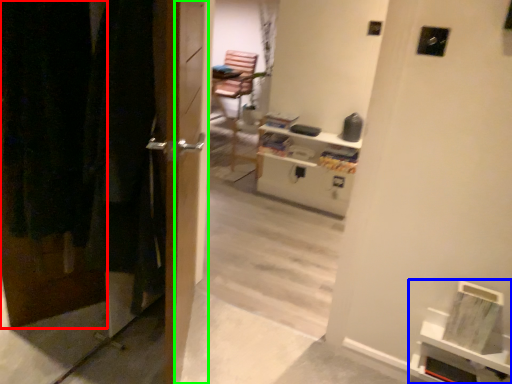
Question: Which object is the farthest from door (highlighted by a red box)? Choose among these: shelf (highlighted by a blue box) or screen door (highlighted by a green box).

Choices:
 (A) shelf
 (B) screen door

Answer: (A)